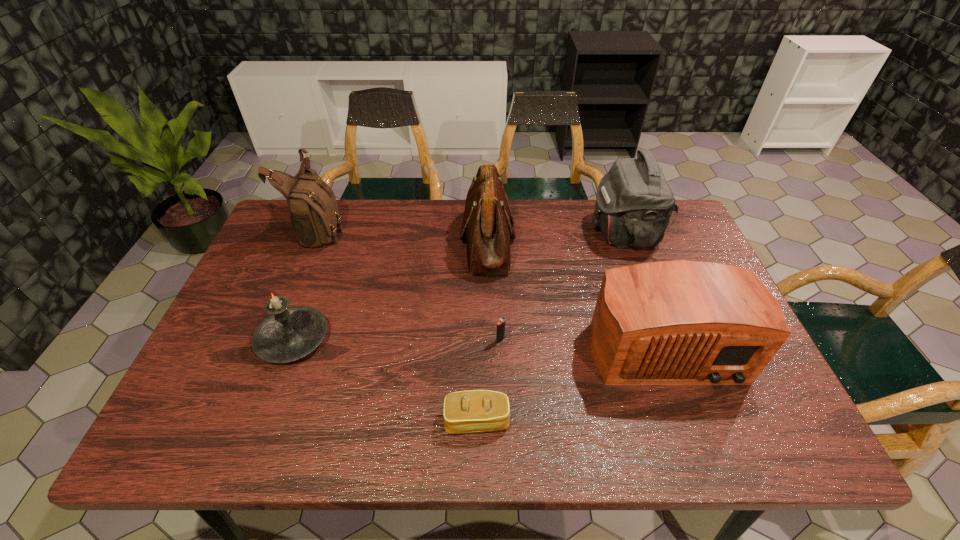
Image resolution: width=960 pixels, height=540 pixels. I want to click on vacant space that satisfies the following two spatial constraints: 1. on the front-facing side of the second shortest object; 2. on the right side of the leftmost shoulder bag, so [x=276, y=340].

Where is `blank area in the image that satisfies the following two spatial constraints: 1. on the front-facing side of the leftmost shoulder bag; 2. on the left side of the second shoulder bag from left to right`? Image resolution: width=960 pixels, height=540 pixels. blank area in the image that satisfies the following two spatial constraints: 1. on the front-facing side of the leftmost shoulder bag; 2. on the left side of the second shoulder bag from left to right is located at coordinates (316, 241).

Locate an element on the screen. Image resolution: width=960 pixels, height=540 pixels. free spot that satisfies the following two spatial constraints: 1. on the front-facing side of the leftmost shoulder bag; 2. on the right side of the third shortest object is located at coordinates (276, 339).